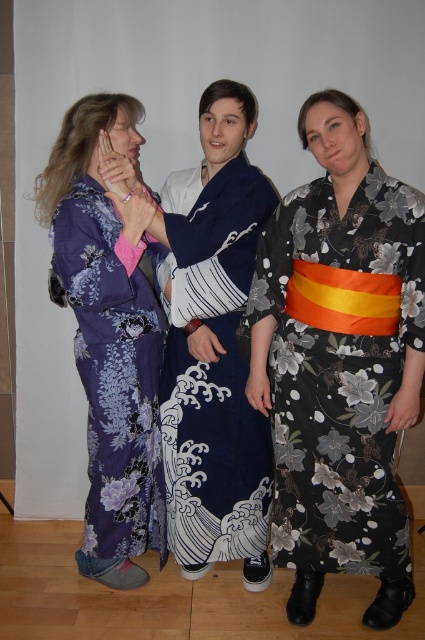
Who is lower down, purple floral kimono at left or navy blue silk kimono at center?

navy blue silk kimono at center is lower down.

Does purple floral kimono at left have a larger size compared to navy blue silk kimono at center?

Yes.

Does point (116, 282) come in front of point (229, 524)?

Yes.

The width and height of the screenshot is (425, 640). Find the location of `purple floral kimono at left`. purple floral kimono at left is located at coordinates (110, 337).

Does black floral kimono at right have a lesser height compared to purple floral kimono at left?

Yes.

Is point (357, 435) closer to camera compared to point (161, 477)?

Yes.

Find the location of a particular element. The width and height of the screenshot is (425, 640). black floral kimono at right is located at coordinates (339, 374).

Can you confirm if black floral kimono at right is bigger than navy blue silk kimono at center?

Indeed, black floral kimono at right has a larger size compared to navy blue silk kimono at center.

Between black floral kimono at right and navy blue silk kimono at center, which one has less height?

With less height is black floral kimono at right.

I want to click on black floral kimono at right, so click(x=339, y=374).

Locate an element on the screen. The height and width of the screenshot is (640, 425). black floral kimono at right is located at coordinates (339, 374).